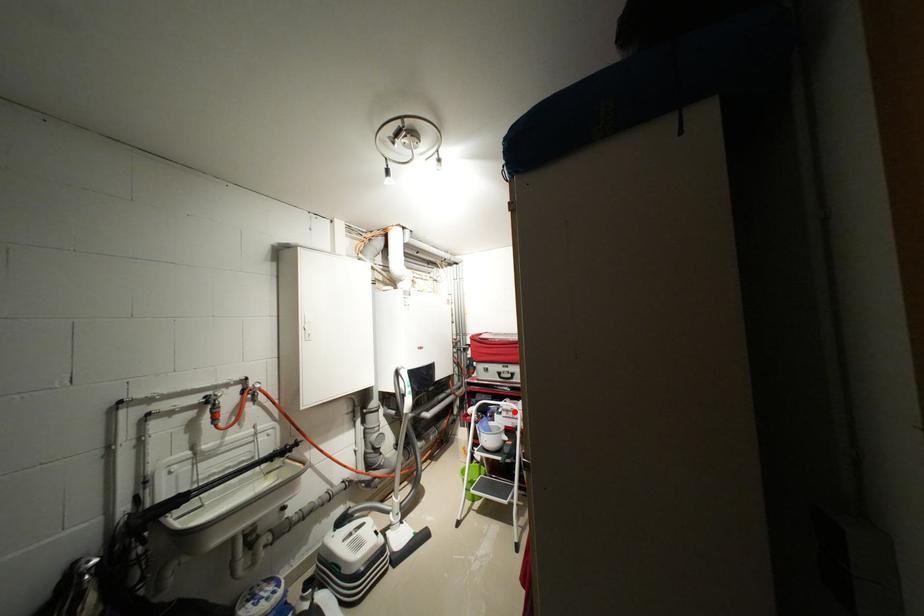
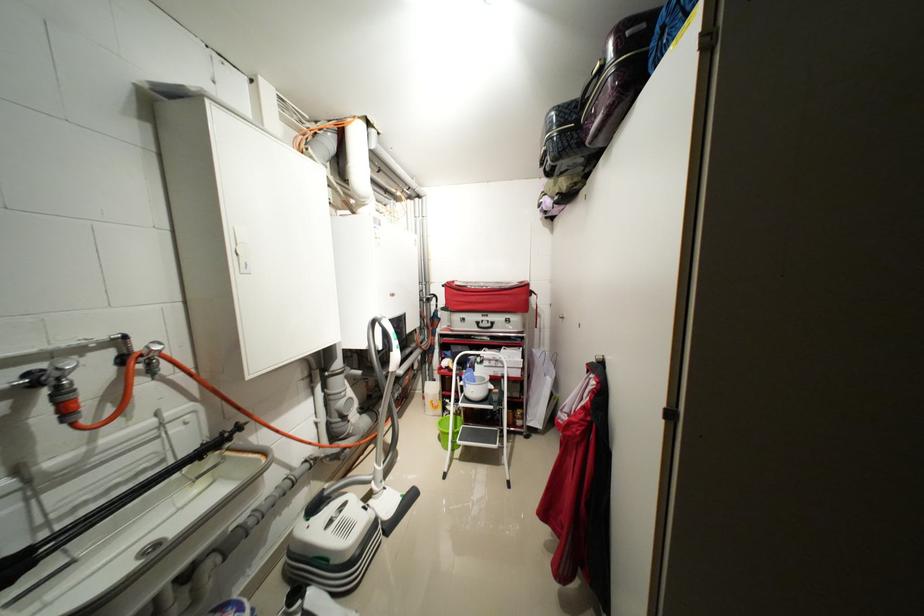
Question: A red point is marked in image1. In image2, is the corresponding 3D point closer to the camera or farther? Reply with the corresponding letter.

Choices:
 (A) The corresponding 3D point is closer.
 (B) The corresponding 3D point is farther.

Answer: (A)